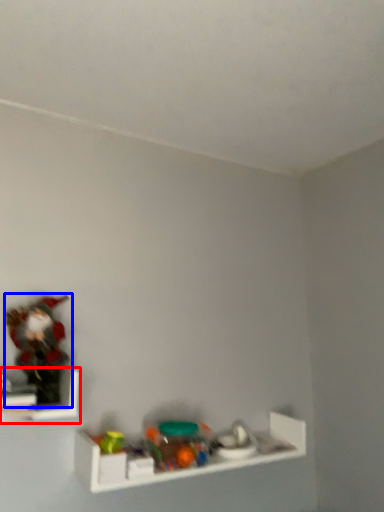
Question: Which object appears farthest to the camera in this image, shelf (highlighted by a red box) or toy (highlighted by a blue box)?

Choices:
 (A) shelf
 (B) toy

Answer: (B)